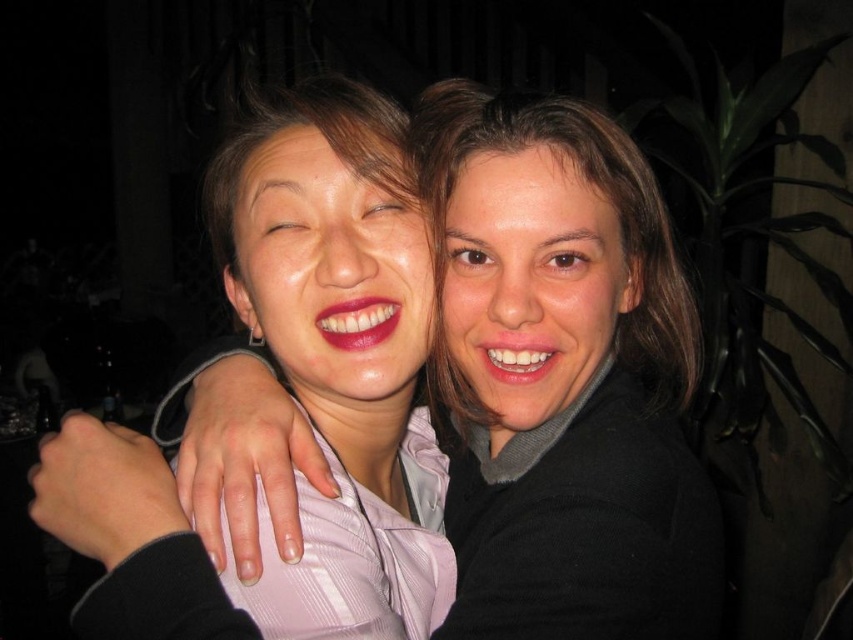
Based on the scene description, where is the matte pink shirt at center located in the image?

The matte pink shirt at center is located at point (340, 355).

You are a photographer trying to capture a clear shot of the matte pink shirt at center and the smooth brown hair at center. Which object should you focus on first to ensure both are in focus?

The matte pink shirt at center is in front of the smooth brown hair at center. To ensure both are in focus, you should focus on the matte pink shirt at center first since it is closer to the camera.

You are taking a photo of two people standing in front of you. You notice two points in the image at coordinates point (430,442) and point (618,212). Which point is closer to the camera?

Point (618,212) is closer to the camera because it is in front of point (430,442).